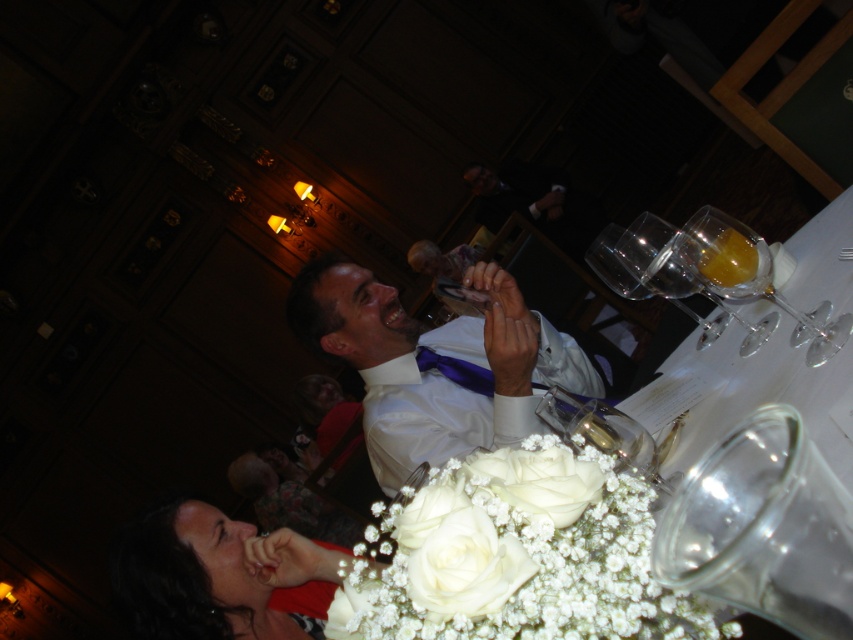
You are standing at the entrance of the event hall and see the white silk flowers at lower center and the smooth white dress at lower left. Which object is closer to the right side of the hall?

The white silk flowers at lower center are closer to the right side of the hall because they are positioned to the right of the smooth white dress at lower left.

You are standing in the grand room and see two points marked in the image. Which point is closer to you, point (219, 624) or point (654, 481)?

Point (219, 624) is closer to you because it is further to the viewer than point (654, 481).

You are a photographer at the event and need to capture a closeup shot of the white silk flowers at lower center without the smooth white dress at lower left appearing in the background. Is the size difference between them sufficient to allow this?

The white silk flowers at lower center are smaller than the smooth white dress at lower left, so if positioned correctly, the photographer can focus on the white silk flowers at lower center while keeping the smooth white dress at lower left out of the frame by using depth of field or adjusting the camera angle to emphasize the smaller object.